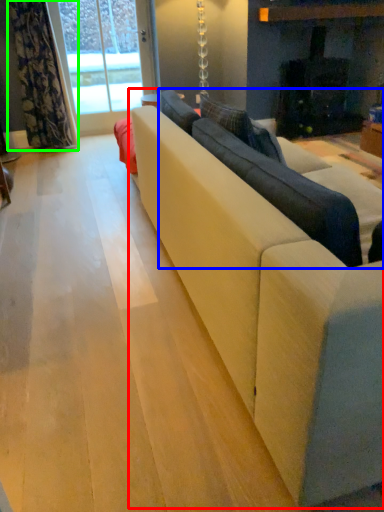
Question: Based on their relative distances, which object is nearer to studio couch (highlighted by a red box)? Choose from couch (highlighted by a blue box) and curtain (highlighted by a green box).

Choices:
 (A) couch
 (B) curtain

Answer: (A)